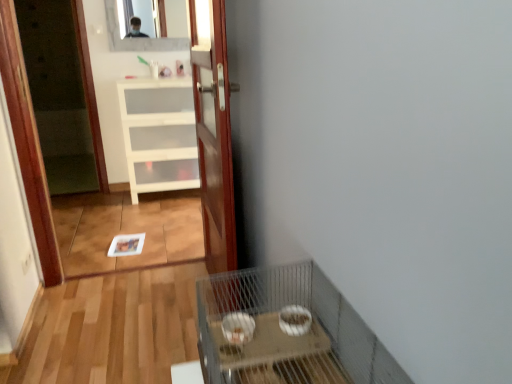
This screenshot has width=512, height=384. Identify the location of wooden door at center. click(213, 131).

Locate an element on the screen. Image resolution: width=512 pixels, height=384 pixels. clear glass mirror at upper center is located at coordinates (137, 39).

From the image's perspective, which is above, wooden door at center or clear glass mirror at upper center?

clear glass mirror at upper center.

Is wooden door at center bigger than clear glass mirror at upper center?

Indeed, wooden door at center has a larger size compared to clear glass mirror at upper center.

Considering the points (221, 147) and (108, 18), which point is in front, point (221, 147) or point (108, 18)?

The point (221, 147) is closer.

Locate an element on the screen. This screenshot has width=512, height=384. mirror on the left of the wooden door at center is located at coordinates (137, 39).

Is wooden door at center positioned in front of white matte cabinet at center?

Yes, it is in front of white matte cabinet at center.

Does point (211, 174) lie in front of point (172, 169)?

That is True.

Considering the sizes of wooden door at center and white matte cabinet at center in the image, is wooden door at center wider or thinner than white matte cabinet at center?

Clearly, wooden door at center has less width compared to white matte cabinet at center.

From a real-world perspective, between wooden door at center and white matte cabinet at center, who is vertically lower?

white matte cabinet at center, from a real-world perspective.

Can clear glass mirror at upper center be found inside white matte cabinet at center?

Definitely not — clear glass mirror at upper center is not inside white matte cabinet at center.

From a real-world perspective, between white matte cabinet at center and clear glass mirror at upper center, who is vertically higher?

clear glass mirror at upper center is physically above.

Does white matte cabinet at center have a smaller size compared to clear glass mirror at upper center?

No.

Considering the sizes of white matte cabinet at center and clear glass mirror at upper center in the image, is white matte cabinet at center wider or thinner than clear glass mirror at upper center?

In the image, white matte cabinet at center appears to be wider than clear glass mirror at upper center.

Can you tell me how much white matte cabinet at center and wooden door at center differ in facing direction?

They differ by 88.7 degrees in their facing directions.

Is white matte cabinet at center facing away from wooden door at center?

No, white matte cabinet at center is not facing the opposite direction of wooden door at center.

Is white matte cabinet at center taller or shorter than wooden door at center?

In the image, white matte cabinet at center appears to be shorter than wooden door at center.

Does white matte cabinet at center have a greater width compared to wooden door at center?

Yes, white matte cabinet at center is wider than wooden door at center.

Is metal wire cage at lower right turned away from wooden door at center?

metal wire cage at lower right is not turned away from wooden door at center.

Based on their positions, is metal wire cage at lower right located to the left or right of wooden door at center?

Based on their positions, metal wire cage at lower right is located to the right of wooden door at center.

Considering the relative sizes of metal wire cage at lower right and wooden door at center in the image provided, is metal wire cage at lower right smaller than wooden door at center?

Correct, metal wire cage at lower right occupies less space than wooden door at center.

Is metal wire cage at lower right positioned before wooden door at center?

Yes, metal wire cage at lower right is closer to the camera.

In the scene shown: Is clear glass mirror at upper center with metal wire cage at lower right?

They are not placed beside each other.

Who is bigger, clear glass mirror at upper center or metal wire cage at lower right?

Bigger between the two is metal wire cage at lower right.

Locate an element on the screen. The width and height of the screenshot is (512, 384). cage lying on the right of clear glass mirror at upper center is located at coordinates (264, 329).

Considering the relative sizes of metal wire cage at lower right and clear glass mirror at upper center in the image provided, is metal wire cage at lower right shorter than clear glass mirror at upper center?

Yes.

In the scene shown: Could you tell me if metal wire cage at lower right is facing clear glass mirror at upper center?

No, metal wire cage at lower right is not aimed at clear glass mirror at upper center.

Who is smaller, metal wire cage at lower right or clear glass mirror at upper center?

clear glass mirror at upper center.

Can we say metal wire cage at lower right lies outside clear glass mirror at upper center?

metal wire cage at lower right is positioned outside clear glass mirror at upper center.

At what (x,y) coordinates should I click in order to perform the action: click on mirror located above the wooden door at center (from the image's perspective). Please return your answer as a coordinate pair (x, y). Looking at the image, I should click on [137, 39].

In the image, there is a white matte cabinet at center. What are the coordinates of `door below it (from the image's perspective)` in the screenshot? It's located at (213, 131).

Based on their spatial positions, is metal wire cage at lower right or white matte cabinet at center further from clear glass mirror at upper center?

metal wire cage at lower right lies further to clear glass mirror at upper center than the other object.

Consider the image. Based on their spatial positions, is wooden door at center or white matte cabinet at center further from clear glass mirror at upper center?

wooden door at center lies further to clear glass mirror at upper center than the other object.

Considering their positions, is white matte cabinet at center positioned further to clear glass mirror at upper center than metal wire cage at lower right?

metal wire cage at lower right is positioned further to the anchor clear glass mirror at upper center.

Based on their spatial positions, is clear glass mirror at upper center or white matte cabinet at center further from wooden door at center?

clear glass mirror at upper center is further to wooden door at center.

Based on their spatial positions, is white matte cabinet at center or clear glass mirror at upper center further from wooden door at center?

clear glass mirror at upper center.

Looking at the image, which one is located closer to metal wire cage at lower right, clear glass mirror at upper center or wooden door at center?

wooden door at center lies closer to metal wire cage at lower right than the other object.

Looking at the image, which one is located closer to wooden door at center, metal wire cage at lower right or clear glass mirror at upper center?

The object closer to wooden door at center is metal wire cage at lower right.

Estimate the real-world distances between objects in this image. Which object is closer to white matte cabinet at center, clear glass mirror at upper center or wooden door at center?

clear glass mirror at upper center is closer to white matte cabinet at center.

Identify the location of cabinetry positioned between metal wire cage at lower right and clear glass mirror at upper center from near to far. (159, 134).

Locate an element on the screen. The width and height of the screenshot is (512, 384). door between metal wire cage at lower right and clear glass mirror at upper center in the front-back direction is located at coordinates (213, 131).

This screenshot has width=512, height=384. Identify the location of door between metal wire cage at lower right and white matte cabinet at center from front to back. click(213, 131).

The width and height of the screenshot is (512, 384). Find the location of `cabinetry positioned between wooden door at center and clear glass mirror at upper center from near to far`. cabinetry positioned between wooden door at center and clear glass mirror at upper center from near to far is located at coordinates click(159, 134).